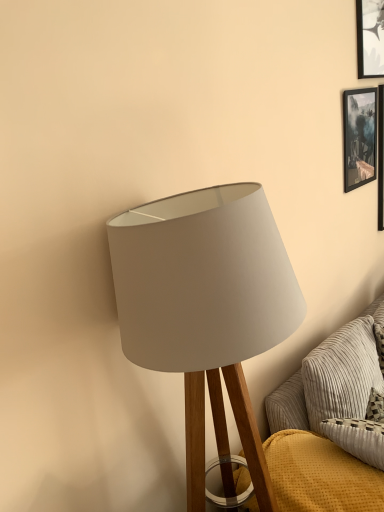
Question: From the image's perspective, does textured gray couch at lower right appear higher than white fabric lampshade at center?

Choices:
 (A) yes
 (B) no

Answer: (B)

Question: Considering the relative sizes of textured gray couch at lower right and white fabric lampshade at center in the image provided, is textured gray couch at lower right taller than white fabric lampshade at center?

Choices:
 (A) yes
 (B) no

Answer: (B)

Question: Is textured gray couch at lower right not inside white fabric lampshade at center?

Choices:
 (A) no
 (B) yes

Answer: (B)

Question: Would you consider textured gray couch at lower right to be distant from white fabric lampshade at center?

Choices:
 (A) no
 (B) yes

Answer: (A)

Question: Is white fabric lampshade at center at the back of textured gray couch at lower right?

Choices:
 (A) no
 (B) yes

Answer: (A)

Question: Is textured gray couch at lower right behind white fabric lampshade at center?

Choices:
 (A) yes
 (B) no

Answer: (A)

Question: Does white fabric lampshade at center have a lesser width compared to black glossy picture frame at upper right?

Choices:
 (A) yes
 (B) no

Answer: (B)

Question: Does white fabric lampshade at center have a greater height compared to black glossy picture frame at upper right?

Choices:
 (A) no
 (B) yes

Answer: (B)

Question: Is white fabric lampshade at center placed right next to black glossy picture frame at upper right?

Choices:
 (A) no
 (B) yes

Answer: (A)

Question: From the image's perspective, is white fabric lampshade at center over black glossy picture frame at upper right?

Choices:
 (A) yes
 (B) no

Answer: (B)

Question: Is white fabric lampshade at center at the right side of black glossy picture frame at upper right?

Choices:
 (A) yes
 (B) no

Answer: (B)

Question: Is white fabric lampshade at center located outside black glossy picture frame at upper right?

Choices:
 (A) yes
 (B) no

Answer: (A)

Question: Is black glossy picture frame at upper right in front of textured gray couch at lower right?

Choices:
 (A) no
 (B) yes

Answer: (A)